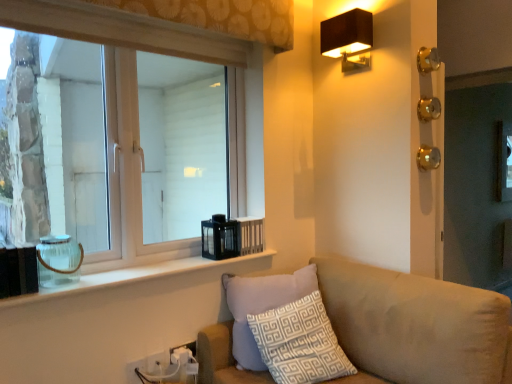
Question: Based on their positions, is clear glass jar at lower left located to the left or right of white plastic electric outlet at lower center, which appears as the second electric outlet when viewed from the front?

Choices:
 (A) left
 (B) right

Answer: (A)

Question: Does point (137, 268) appear closer or farther from the camera than point (145, 359)?

Choices:
 (A) farther
 (B) closer

Answer: (A)

Question: Which object is positioned closest to the white plastic electric outlet at lower left, which is counted as the 1th electric outlet, starting from the left?

Choices:
 (A) clear glass jar at left
 (B) white patterned cushion at lower center
 (C) white plastic electric outlet at lower center, which ranks as the 2th electric outlet in right-to-left order
 (D) black fabric lampshade at upper right
 (E) beige fabric couch at lower right

Answer: (C)

Question: Based on their relative distances, which object is nearer to the white plastic electric outlet at lower left, which is counted as the 1th electric outlet, starting from the left?

Choices:
 (A) clear glass jar at left
 (B) beige fabric couch at lower right
 (C) clear glass window at upper left
 (D) black fabric lampshade at upper right
 (E) white plastic electric outlet at lower center, acting as the third electric outlet starting from the left

Answer: (E)